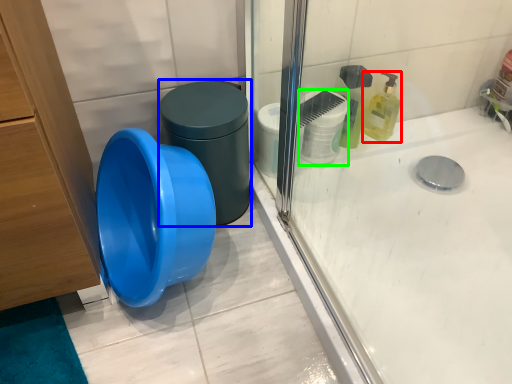
Question: Estimate the real-world distances between objects in this image. Which object is farther from cleaning product (highlighted by a red box), potty (highlighted by a blue box) or toilet paper (highlighted by a green box)?

Choices:
 (A) potty
 (B) toilet paper

Answer: (A)